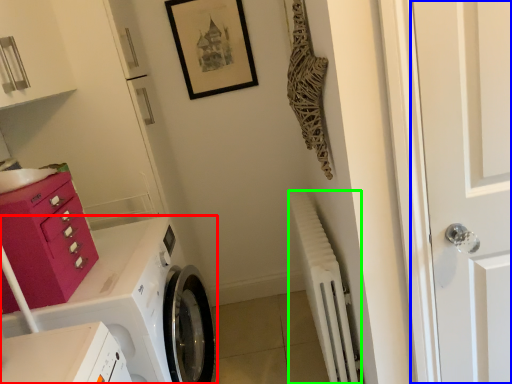
Question: Based on their relative distances, which object is nearer to washing machine (highlighted by a red box)? Choose from door (highlighted by a blue box) and radiator (highlighted by a green box).

Choices:
 (A) door
 (B) radiator

Answer: (B)